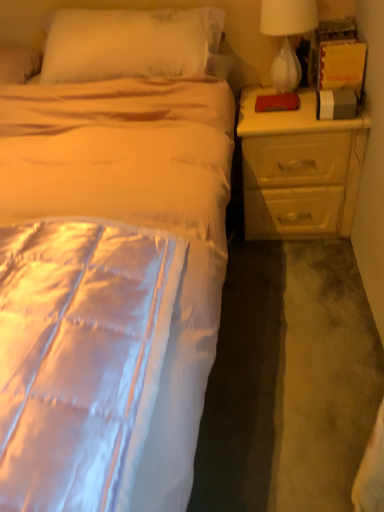
The height and width of the screenshot is (512, 384). Identify the location of blank space situated above yellow matte nightstand at right (from a real-world perspective). (285, 106).